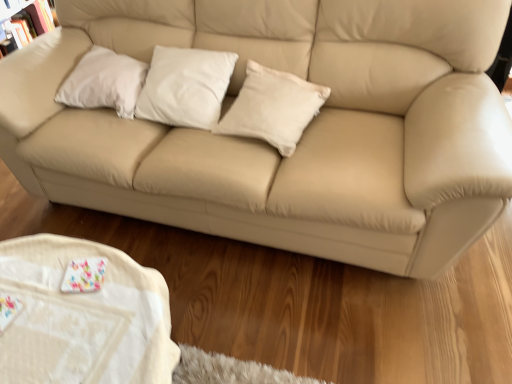
Where is `free space above white cotton pillow at center, placed as the third pillow when sorted from left to right (from a real-world perspective)`? free space above white cotton pillow at center, placed as the third pillow when sorted from left to right (from a real-world perspective) is located at coordinates (277, 80).